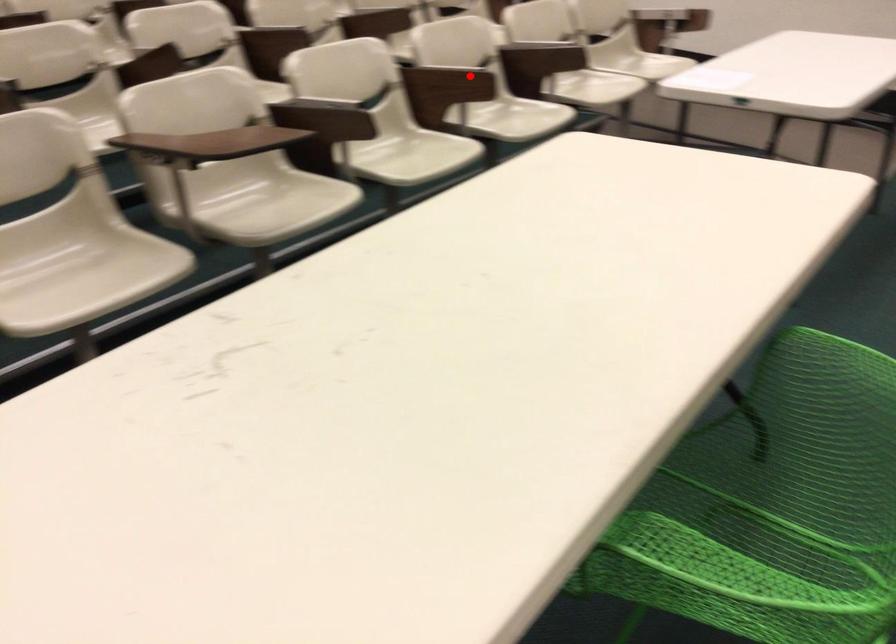
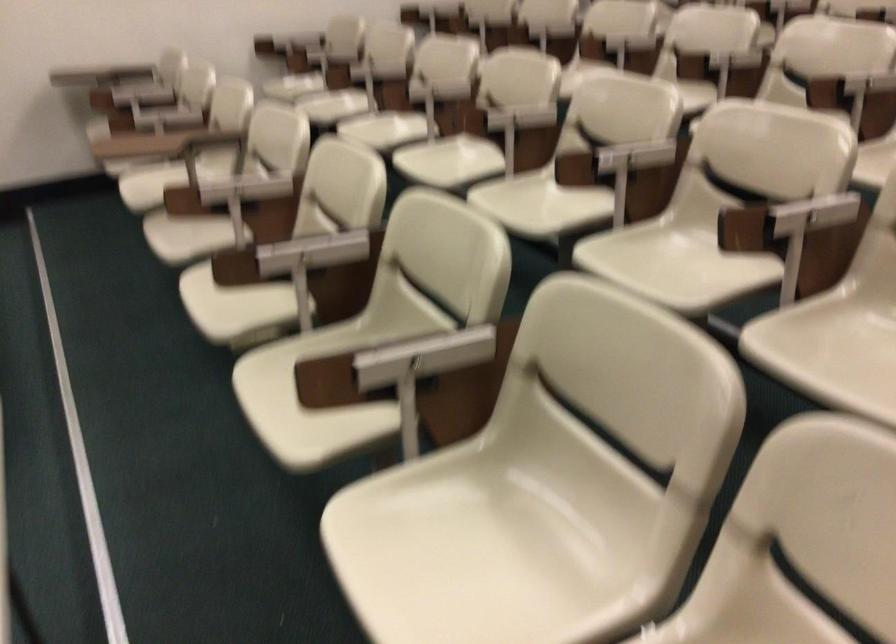
Question: A red point is marked in image1. In image2, is the corresponding 3D point closer to the camera or farther? Reply with the corresponding letter.

Choices:
 (A) The corresponding 3D point is closer.
 (B) The corresponding 3D point is farther.

Answer: (A)